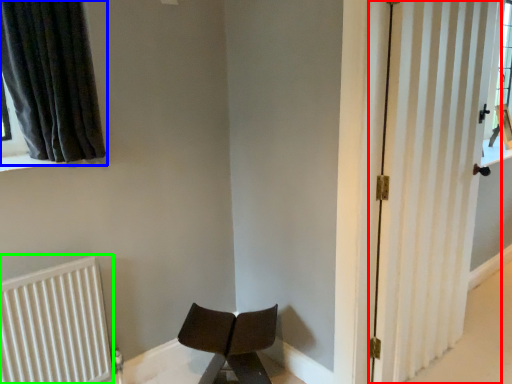
Question: Which object is the closest to the door (highlighted by a red box)? Choose among these: curtain (highlighted by a blue box) or radiator (highlighted by a green box).

Choices:
 (A) curtain
 (B) radiator

Answer: (A)